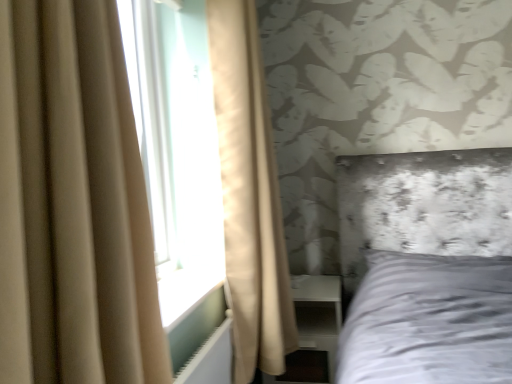
Question: Is beige fabric curtain at left, the 1th curtain positioned from the back, located within white plastic radiator at lower left?

Choices:
 (A) no
 (B) yes

Answer: (A)

Question: Considering the relative sizes of white plastic radiator at lower left and beige fabric curtain at left, positioned as the second curtain in front-to-back order, in the image provided, is white plastic radiator at lower left shorter than beige fabric curtain at left, positioned as the second curtain in front-to-back order,?

Choices:
 (A) yes
 (B) no

Answer: (A)

Question: Is white plastic radiator at lower left not within beige fabric curtain at left, the 1th curtain positioned from the back?

Choices:
 (A) yes
 (B) no

Answer: (A)

Question: From the image's perspective, would you say white plastic radiator at lower left is positioned over beige fabric curtain at left, the 1th curtain positioned from the back?

Choices:
 (A) yes
 (B) no

Answer: (B)

Question: Can you confirm if white plastic radiator at lower left is bigger than beige fabric curtain at left, positioned as the second curtain in front-to-back order?

Choices:
 (A) yes
 (B) no

Answer: (B)

Question: From the image's perspective, relative to white plastic radiator at lower left, is white glossy dresser at lower right above or below?

Choices:
 (A) below
 (B) above

Answer: (A)

Question: Would you say white glossy dresser at lower right is to the left or to the right of white plastic radiator at lower left in the picture?

Choices:
 (A) right
 (B) left

Answer: (A)

Question: Is white glossy dresser at lower right spatially inside white plastic radiator at lower left, or outside of it?

Choices:
 (A) outside
 (B) inside

Answer: (A)

Question: From a real-world perspective, is white glossy dresser at lower right physically located above or below white plastic radiator at lower left?

Choices:
 (A) below
 (B) above

Answer: (A)

Question: Is beige fabric curtain at left, arranged as the 2th curtain when viewed from the back, wider or thinner than white glossy dresser at lower right?

Choices:
 (A) thin
 (B) wide

Answer: (A)

Question: From a real-world perspective, is beige fabric curtain at left, the first curtain in the front-to-back sequence, physically located above or below white glossy dresser at lower right?

Choices:
 (A) above
 (B) below

Answer: (A)

Question: Is beige fabric curtain at left, arranged as the 2th curtain when viewed from the back, inside the boundaries of white glossy dresser at lower right, or outside?

Choices:
 (A) inside
 (B) outside

Answer: (B)

Question: In the image, is beige fabric curtain at left, arranged as the 2th curtain when viewed from the back, on the left side or the right side of white glossy dresser at lower right?

Choices:
 (A) right
 (B) left

Answer: (B)

Question: In terms of width, does white plastic radiator at lower left look wider or thinner when compared to beige fabric curtain at left, arranged as the 2th curtain when viewed from the back?

Choices:
 (A) thin
 (B) wide

Answer: (A)

Question: From a real-world perspective, relative to beige fabric curtain at left, the first curtain in the front-to-back sequence, is white plastic radiator at lower left vertically above or below?

Choices:
 (A) below
 (B) above

Answer: (A)